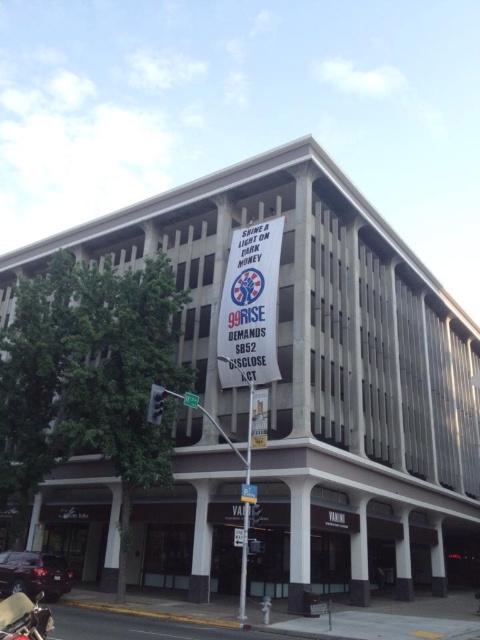
Question: From the image, what is the correct spatial relationship of shiny chrome motorcycle at lower left in relation to metallic pole at center?

Choices:
 (A) above
 (B) below

Answer: (A)

Question: Which object is positioned farthest from the metallic pole at center?

Choices:
 (A) shiny chrome motorcycle at lower left
 (B) green plastic street sign at upper center

Answer: (A)

Question: Is shiny chrome motorcycle at lower left further to camera compared to metallic pole at center?

Choices:
 (A) no
 (B) yes

Answer: (A)

Question: In this image, where is shiny chrome motorcycle at lower left located relative to metallic pole at center?

Choices:
 (A) above
 (B) below

Answer: (A)

Question: Which object appears farthest from the camera in this image?

Choices:
 (A) green plastic street sign at upper center
 (B) shiny chrome motorcycle at lower left
 (C) metallic pole at center

Answer: (A)

Question: Which of the following is the closest to the observer?

Choices:
 (A) shiny chrome motorcycle at lower left
 (B) metallic pole at center
 (C) green plastic street sign at upper center

Answer: (A)